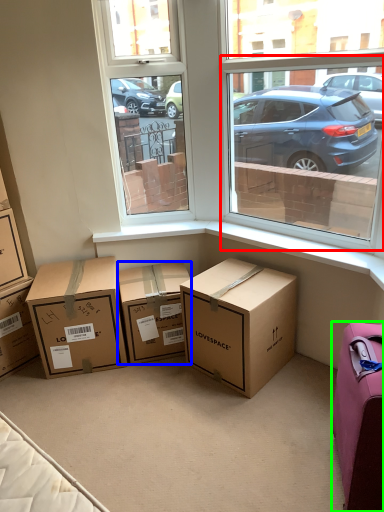
Question: Which object is the closest to the window screen (highlighted by a red box)? Choose among these: box (highlighted by a blue box) or suitcase (highlighted by a green box).

Choices:
 (A) box
 (B) suitcase

Answer: (A)